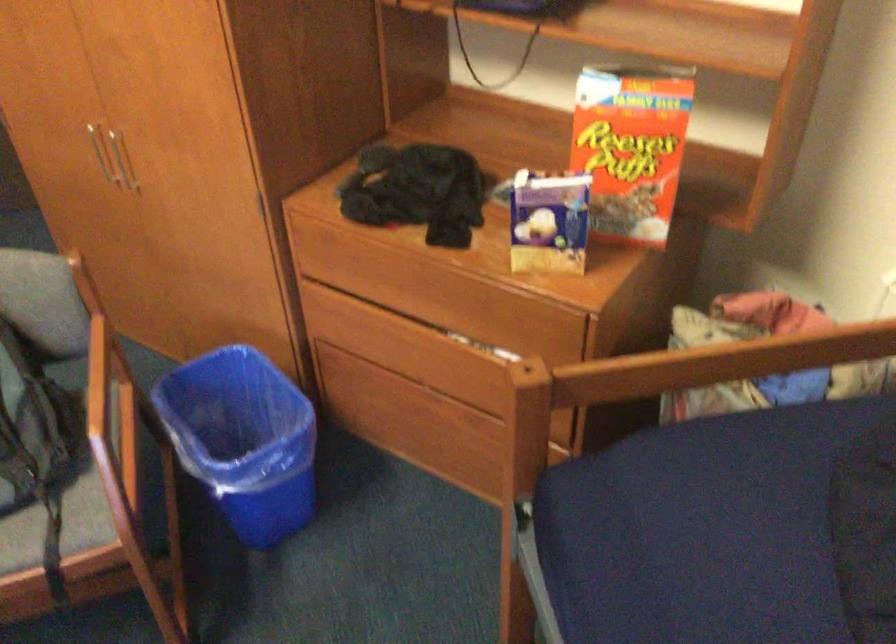
The location [631,146] corresponds to which object?

This point indicates the cereal box.